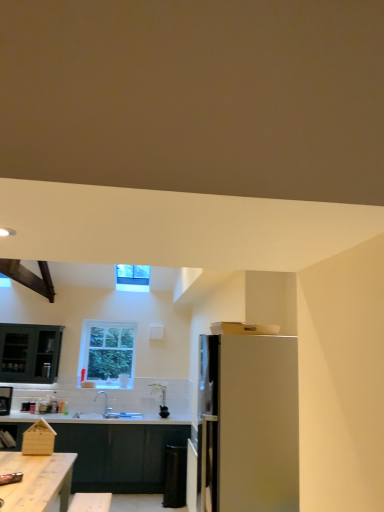
This screenshot has height=512, width=384. What do you see at coordinates (108, 352) in the screenshot? I see `white glass window at center` at bounding box center [108, 352].

Locate an element on the screen. The height and width of the screenshot is (512, 384). metallic silver toaster at lower left is located at coordinates (5, 400).

Based on the photo, what is the approximate height of dark wood exhaust hood at upper left?

It is 8.65 inches.

Find the location of `dark wood exhaust hood at upper left`. dark wood exhaust hood at upper left is located at coordinates (x=29, y=277).

The width and height of the screenshot is (384, 512). What do you see at coordinates (249, 422) in the screenshot?
I see `white glossy refrigerator at right` at bounding box center [249, 422].

Locate an element on the screen. Image resolution: width=384 pixels, height=512 pixels. white glass window at center is located at coordinates (108, 352).

Is white glossy refrigerator at right oriented towards dark gray matte cabinetry at lower center?

No.

Are white glossy refrigerator at right and dark gray matte cabinetry at lower center beside each other?

white glossy refrigerator at right and dark gray matte cabinetry at lower center are clearly separated.

In terms of height, does white glossy refrigerator at right look taller or shorter compared to dark gray matte cabinetry at lower center?

white glossy refrigerator at right is taller than dark gray matte cabinetry at lower center.

Is point (278, 483) closer or farther from the camera than point (118, 479)?

Point (278, 483) appears to be closer to the viewer than point (118, 479).

Looking at this image, is white glossy sink at center bigger or smaller than dark gray matte cabinetry at lower center?

In the image, white glossy sink at center appears to be smaller than dark gray matte cabinetry at lower center.

Which of these two, white glossy sink at center or dark gray matte cabinetry at lower center, stands shorter?

Standing shorter between the two is white glossy sink at center.

Is white glossy sink at center aimed at dark gray matte cabinetry at lower center?

No.

Is white glossy sink at center not within white glass window at center?

Yes.

Considering the relative sizes of white glossy sink at center and white glass window at center in the image provided, is white glossy sink at center thinner than white glass window at center?

No, white glossy sink at center is not thinner than white glass window at center.

Is white glossy sink at center shorter than white glass window at center?

Yes, white glossy sink at center is shorter than white glass window at center.

Is white glossy sink at center turned away from white glass window at center?

white glossy sink at center is not turned away from white glass window at center.

In the scene shown: Is dark wood exhaust hood at upper left facing away from white glass window at center?

dark wood exhaust hood at upper left does not have its back to white glass window at center.

Is dark wood exhaust hood at upper left spatially inside white glass window at center, or outside of it?

The correct answer is: outside.

From a real-world perspective, between dark wood exhaust hood at upper left and white glass window at center, who is vertically lower?

From a 3D spatial view, white glass window at center is below.

Measure the distance between dark wood exhaust hood at upper left and white glossy refrigerator at right.

They are 2.93 meters apart.

Considering the sizes of dark wood exhaust hood at upper left and white glossy refrigerator at right in the image, is dark wood exhaust hood at upper left wider or thinner than white glossy refrigerator at right?

Considering their sizes, dark wood exhaust hood at upper left looks broader than white glossy refrigerator at right.

Is dark wood exhaust hood at upper left directly adjacent to white glossy refrigerator at right?

No, dark wood exhaust hood at upper left is not with white glossy refrigerator at right.

Does dark wood exhaust hood at upper left turn towards white glossy refrigerator at right?

No, dark wood exhaust hood at upper left is not turned towards white glossy refrigerator at right.

From a real-world perspective, which is physically below, dark gray matte cabinetry at lower center or metallic silver toaster at lower left?

dark gray matte cabinetry at lower center, from a real-world perspective.

Is dark gray matte cabinetry at lower center to the left of metallic silver toaster at lower left from the viewer's perspective?

Incorrect, dark gray matte cabinetry at lower center is not on the left side of metallic silver toaster at lower left.

Between dark gray matte cabinetry at lower center and metallic silver toaster at lower left, which one is positioned behind?

metallic silver toaster at lower left is more distant.

From a real-world perspective, between dark gray matte cabinetry at lower center and white glossy refrigerator at right, who is vertically lower?

dark gray matte cabinetry at lower center.

In the scene shown: Is dark gray matte cabinetry at lower center oriented away from white glossy refrigerator at right?

dark gray matte cabinetry at lower center does not have its back to white glossy refrigerator at right.

At what (x,y) coordinates should I click in order to perform the action: click on cabinetry on the left side of white glossy refrigerator at right. Please return your answer as a coordinate pair (x, y). Looking at the image, I should click on (119, 455).

You are a GUI agent. You are given a task and a screenshot of the screen. Output one action in this format:
    pyautogui.click(x=<x>, y=<y>)
    Task: Click on the cabinetry that appears on the left of white glossy refrigerator at right
    The width and height of the screenshot is (384, 512).
    Given the screenshot: What is the action you would take?
    pyautogui.click(x=119, y=455)

I want to click on sink above the dark gray matte cabinetry at lower center (from a real-world perspective), so click(115, 412).

Based on their spatial positions, is metallic silver toaster at lower left or wooden table at lower left further from dark gray matte cabinetry at lower center?

metallic silver toaster at lower left lies further to dark gray matte cabinetry at lower center than the other object.

Looking at the image, which one is located further to white glass window at center, metallic silver toaster at lower left or white glossy sink at center?

Among the two, metallic silver toaster at lower left is located further to white glass window at center.

From the image, which object appears to be farther from wooden table at lower left, dark wood exhaust hood at upper left or white glossy sink at center?

white glossy sink at center lies further to wooden table at lower left than the other object.

Which object lies nearer to the anchor point dark gray matte cabinetry at lower center, wooden table at lower left or metallic silver toaster at lower left?

wooden table at lower left lies closer to dark gray matte cabinetry at lower center than the other object.

Based on their spatial positions, is dark wood exhaust hood at upper left or white glass window at center further from white glossy refrigerator at right?

white glass window at center.

From the image, which object appears to be nearer to white glossy refrigerator at right, white glossy sink at center or wooden table at lower left?

Based on the image, wooden table at lower left appears to be nearer to white glossy refrigerator at right.

Consider the image. From the image, which object appears to be nearer to white glass window at center, dark gray matte cabinetry at lower center or white glossy refrigerator at right?

dark gray matte cabinetry at lower center.

Consider the image. Estimate the real-world distances between objects in this image. Which object is closer to metallic silver toaster at lower left, wooden table at lower left or white glossy refrigerator at right?

wooden table at lower left lies closer to metallic silver toaster at lower left than the other object.

What are the coordinates of `kitchen appliance between dark gray matte cabinetry at lower center and white glass window at center along the z-axis` in the screenshot? It's located at (5, 400).

Identify the location of exhaust hood between white glossy refrigerator at right and white glossy sink at center in the front-back direction. The image size is (384, 512). (29, 277).

You are a GUI agent. You are given a task and a screenshot of the screen. Output one action in this format:
    pyautogui.click(x=<x>, y=<y>)
    Task: Click on the cabinetry between dark wood exhaust hood at upper left and white glass window at center in the front-back direction
    
    Given the screenshot: What is the action you would take?
    pyautogui.click(x=119, y=455)

The height and width of the screenshot is (512, 384). I want to click on exhaust hood between wooden table at lower left and dark gray matte cabinetry at lower center from front to back, so click(x=29, y=277).